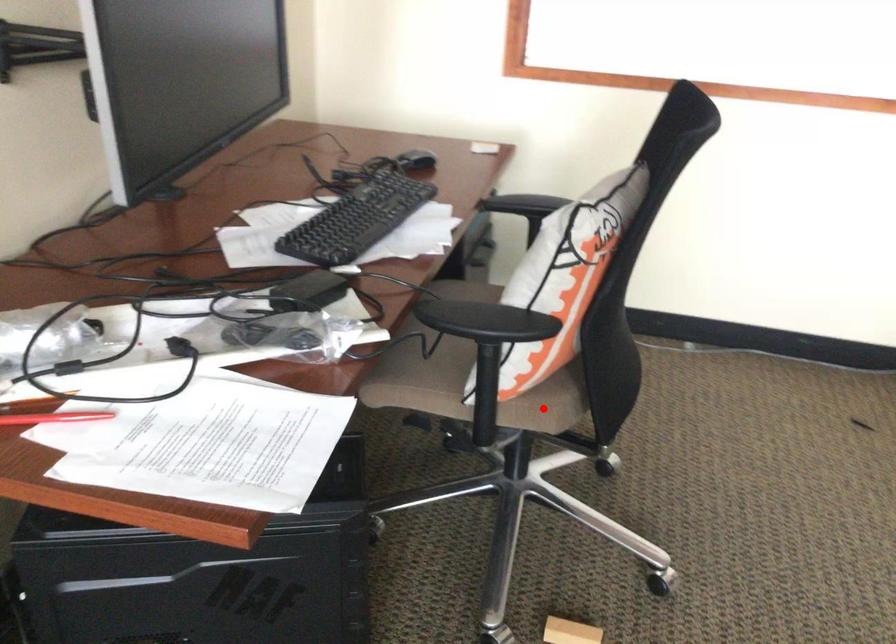
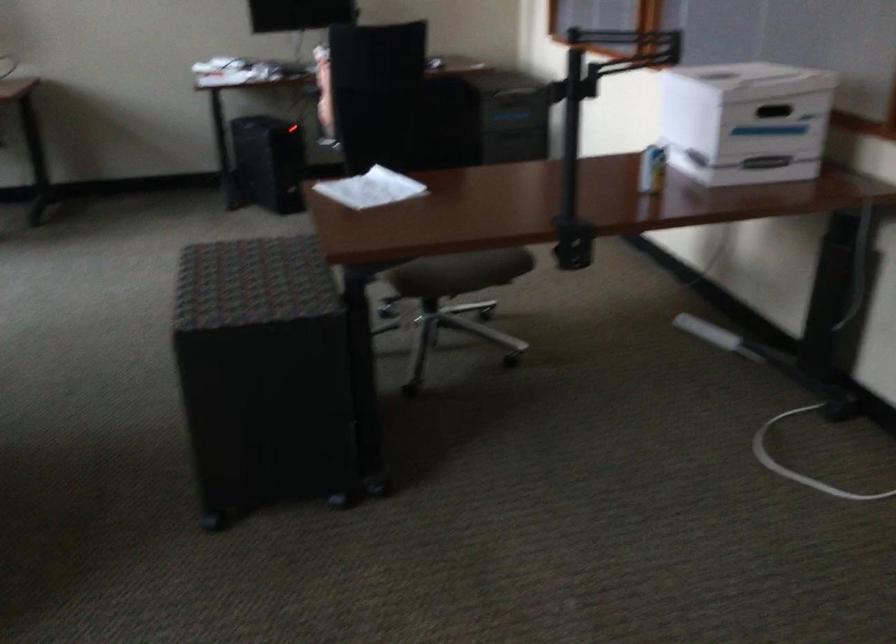
Question: I am providing you with two images of the same scene from different viewpoints. A red point is marked on the first image. Is the red point's position out of view in image 2?

Choices:
 (A) Yes
 (B) No

Answer: (A)